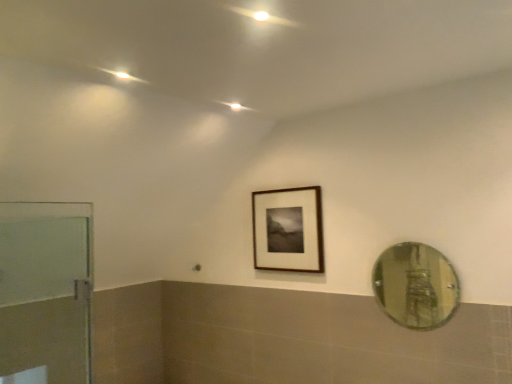
Question: Is green reflective glass mirror at right spatially inside wooden frame at center, or outside of it?

Choices:
 (A) inside
 (B) outside

Answer: (B)

Question: Considering the positions of green reflective glass mirror at right and wooden frame at center in the image, is green reflective glass mirror at right wider or thinner than wooden frame at center?

Choices:
 (A) wide
 (B) thin

Answer: (B)

Question: Which of these objects is positioned closest to the wooden frame at center?

Choices:
 (A) green reflective glass mirror at right
 (B) transparent glass door at left

Answer: (B)

Question: Which object is positioned farthest from the transparent glass door at left?

Choices:
 (A) green reflective glass mirror at right
 (B) wooden frame at center

Answer: (A)